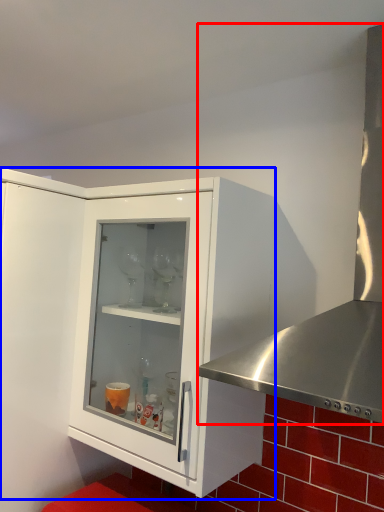
Question: Which of the following is the closest to the observer, kitchen appliance (highlighted by a red box) or cabinetry (highlighted by a blue box)?

Choices:
 (A) kitchen appliance
 (B) cabinetry

Answer: (A)